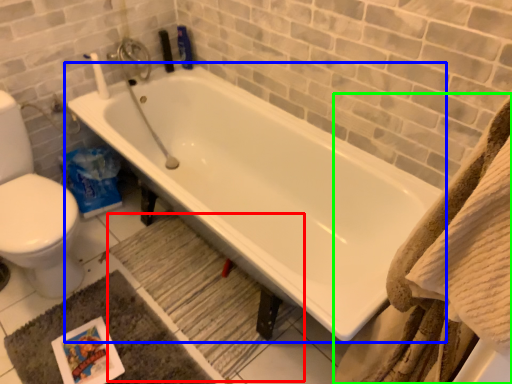
Question: Which is nearer to the bath mat (highlighted by a red box)? bathtub (highlighted by a blue box) or bath towel (highlighted by a green box).

Choices:
 (A) bathtub
 (B) bath towel

Answer: (A)